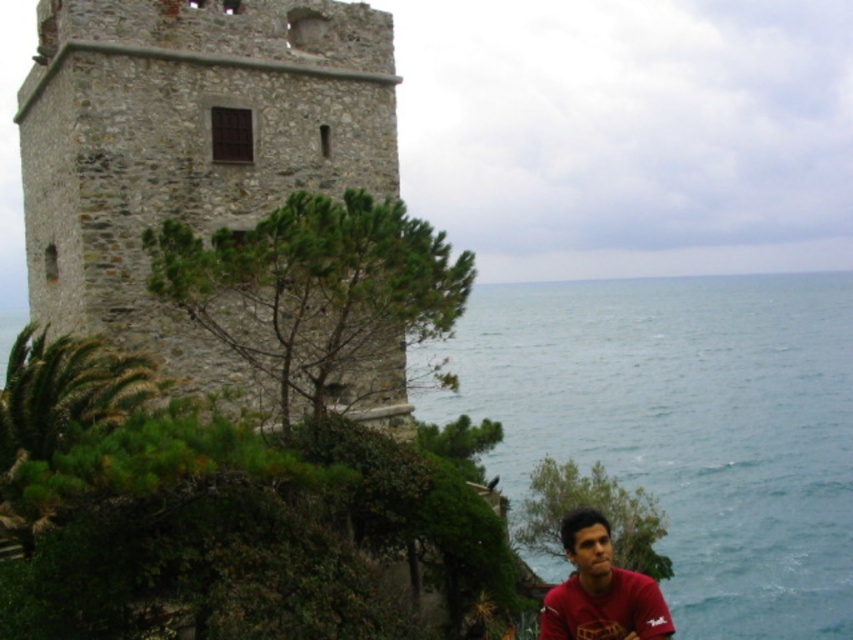
Question: Which of these objects is positioned farthest from the matte red shirt at lower right?

Choices:
 (A) blue water at lower right
 (B) stone tower at left

Answer: (A)

Question: Does blue water at lower right lie behind matte red shirt at lower right?

Choices:
 (A) yes
 (B) no

Answer: (A)

Question: Among these points, which one is nearest to the camera?

Choices:
 (A) (39, 216)
 (B) (642, 321)
 (C) (577, 602)

Answer: (C)

Question: Among these objects, which one is farthest from the camera?

Choices:
 (A) matte red shirt at lower right
 (B) blue water at lower right
 (C) stone tower at left

Answer: (B)

Question: Is the position of stone tower at left more distant than that of matte red shirt at lower right?

Choices:
 (A) yes
 (B) no

Answer: (A)

Question: Does blue water at lower right appear on the left side of matte red shirt at lower right?

Choices:
 (A) no
 (B) yes

Answer: (A)